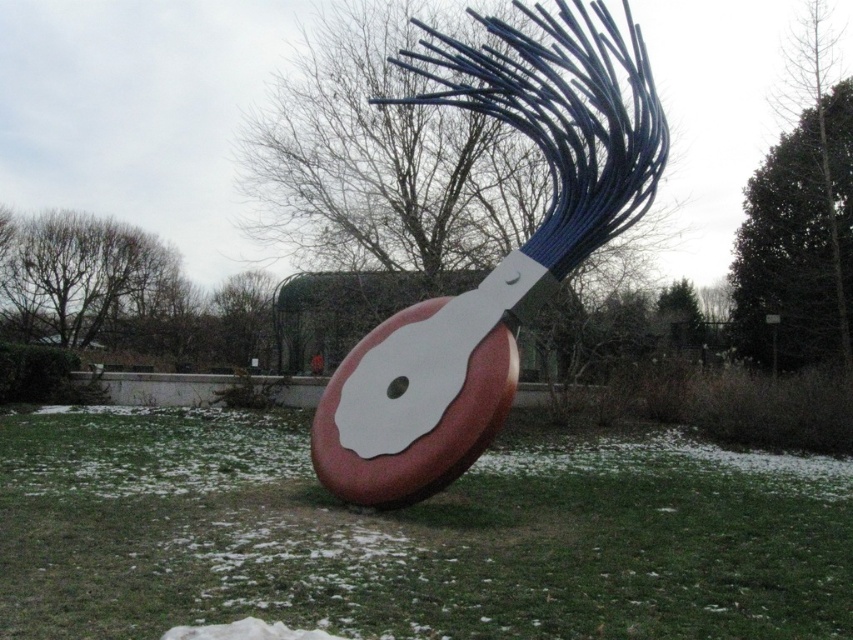
Question: Among these points, which one is farthest from the camera?

Choices:
 (A) (283, 435)
 (B) (485, 310)

Answer: (A)

Question: Does green grass at center have a lesser width compared to matte red and white sculpture at center?

Choices:
 (A) yes
 (B) no

Answer: (B)

Question: Is the position of green grass at center less distant than that of matte red and white sculpture at center?

Choices:
 (A) no
 (B) yes

Answer: (B)

Question: Among these points, which one is nearest to the camera?

Choices:
 (A) (340, 476)
 (B) (498, 493)

Answer: (A)

Question: Is green grass at center positioned behind matte red and white sculpture at center?

Choices:
 (A) no
 (B) yes

Answer: (A)

Question: Among these points, which one is nearest to the camera?

Choices:
 (A) (750, 538)
 (B) (402, 365)

Answer: (A)